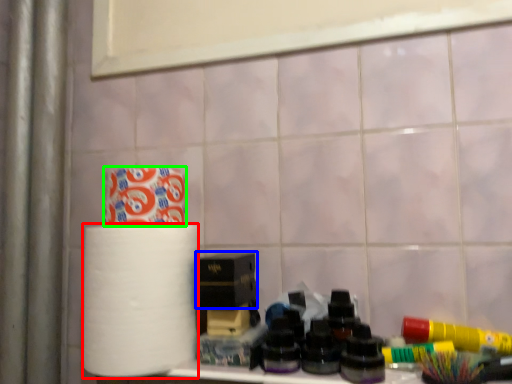
Question: Based on their relative distances, which object is nearer to paper towel (highlighted by a red box)? Choose from box (highlighted by a blue box) and toilet paper (highlighted by a green box).

Choices:
 (A) box
 (B) toilet paper

Answer: (A)